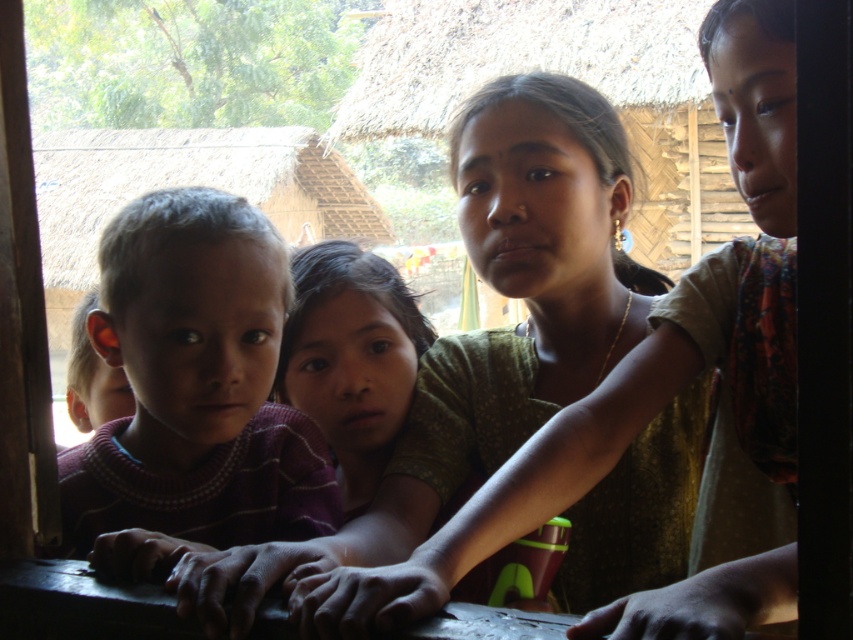
Can you confirm if striped knit sweater at center is bigger than matte green shirt at center?

Yes, striped knit sweater at center is bigger than matte green shirt at center.

Who is lower down, striped knit sweater at center or matte green shirt at center?

matte green shirt at center is below.

I want to click on striped knit sweater at center, so click(x=351, y=358).

Locate an element on the screen. The height and width of the screenshot is (640, 853). striped knit sweater at center is located at coordinates (351, 358).

Based on the photo, does striped knit sweater at left have a smaller size compared to matte green shirt at center?

Yes.

Is striped knit sweater at left thinner than matte green shirt at center?

Incorrect, striped knit sweater at left's width is not less than matte green shirt at center's.

Who is more distant from viewer, (x=123, y=301) or (x=428, y=332)?

Positioned behind is point (x=428, y=332).

Image resolution: width=853 pixels, height=640 pixels. Identify the location of striped knit sweater at left. (192, 392).

Can you confirm if striped knit sweater at left is wider than striped knit sweater at center?

Yes.

Can you confirm if striped knit sweater at left is taller than striped knit sweater at center?

No, striped knit sweater at left is not taller than striped knit sweater at center.

Identify the location of striped knit sweater at left. Image resolution: width=853 pixels, height=640 pixels. (192, 392).

Image resolution: width=853 pixels, height=640 pixels. I want to click on striped knit sweater at left, so click(192, 392).